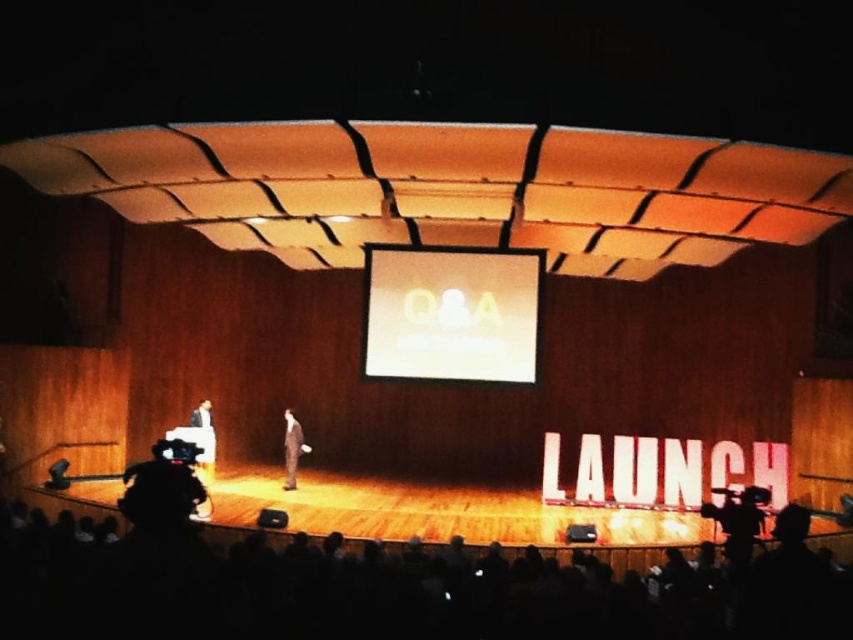
Can you confirm if white glossy screen at center is bigger than dark suit at center?

Yes.

Which is behind, point (408, 275) or point (303, 440)?

The point (303, 440) is behind.

Locate an element on the screen. The height and width of the screenshot is (640, 853). white glossy screen at center is located at coordinates (451, 314).

Does white glossy screen at center appear over light brown suit at left?

Answer: Correct, white glossy screen at center is located above light brown suit at left.

Where is `white glossy screen at center`? white glossy screen at center is located at coordinates (451, 314).

Which of these two, white glossy screen at center or light brown leather jacket at left, stands taller?

white glossy screen at center is taller.

Between point (397, 355) and point (206, 426), which one is positioned in front?

Point (397, 355) is in front.

Identify the location of white glossy screen at center. This screenshot has height=640, width=853. coord(451,314).